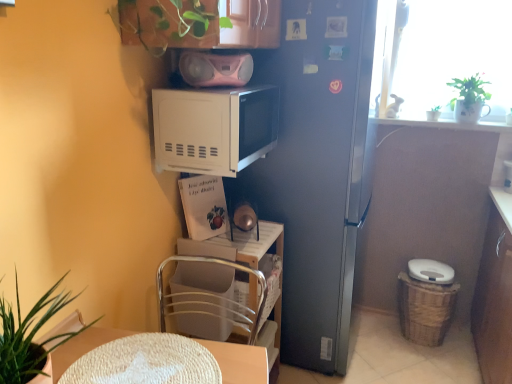
Question: Considering the relative sizes of white glossy pot at upper right, the third houseplant from the front, and white plastic chair at lower center in the image provided, is white glossy pot at upper right, the third houseplant from the front, taller than white plastic chair at lower center?

Choices:
 (A) no
 (B) yes

Answer: (A)

Question: Could you tell me if white glossy pot at upper right, the 2th houseplant positioned from the top, is turned towards white plastic chair at lower center?

Choices:
 (A) yes
 (B) no

Answer: (B)

Question: Considering the relative sizes of white glossy pot at upper right, acting as the second houseplant starting from the right, and white plastic chair at lower center in the image provided, is white glossy pot at upper right, acting as the second houseplant starting from the right, wider than white plastic chair at lower center?

Choices:
 (A) yes
 (B) no

Answer: (B)

Question: Can you confirm if white glossy pot at upper right, the 2th houseplant positioned from the top, is positioned to the left of white plastic chair at lower center?

Choices:
 (A) no
 (B) yes

Answer: (A)

Question: Would you say white plastic chair at lower center is part of white glossy pot at upper right, which is the second houseplant from bottom to top,'s contents?

Choices:
 (A) no
 (B) yes

Answer: (A)

Question: From the image's perspective, is white matte microwave at upper center positioned above or below green matte plant at upper right, the third houseplant positioned from the left?

Choices:
 (A) below
 (B) above

Answer: (A)

Question: In terms of size, does white matte microwave at upper center appear bigger or smaller than green matte plant at upper right, positioned as the second houseplant in front-to-back order?

Choices:
 (A) big
 (B) small

Answer: (A)

Question: Considering the positions of white matte microwave at upper center and green matte plant at upper right, the third houseplant positioned from the left, in the image, is white matte microwave at upper center taller or shorter than green matte plant at upper right, the third houseplant positioned from the left,?

Choices:
 (A) short
 (B) tall

Answer: (B)

Question: Which is correct: white matte microwave at upper center is inside green matte plant at upper right, positioned as the second houseplant in front-to-back order, or outside of it?

Choices:
 (A) outside
 (B) inside

Answer: (A)

Question: Considering the relative positions of white woven placemat at lower center and pink plastic boombox at upper center in the image provided, is white woven placemat at lower center to the left or to the right of pink plastic boombox at upper center?

Choices:
 (A) right
 (B) left

Answer: (B)

Question: Relative to pink plastic boombox at upper center, is white woven placemat at lower center in front or behind?

Choices:
 (A) behind
 (B) front

Answer: (B)

Question: Is white woven placemat at lower center taller or shorter than pink plastic boombox at upper center?

Choices:
 (A) short
 (B) tall

Answer: (A)

Question: Is point (233, 344) positioned closer to the camera than point (199, 54)?

Choices:
 (A) farther
 (B) closer

Answer: (B)

Question: From the image's perspective, is white plastic chair at lower center positioned above or below white glossy pot at upper right, acting as the second houseplant starting from the right?

Choices:
 (A) below
 (B) above

Answer: (A)

Question: Would you say white plastic chair at lower center is to the left or to the right of white glossy pot at upper right, the 1th houseplant positioned from the back, in the picture?

Choices:
 (A) right
 (B) left

Answer: (B)